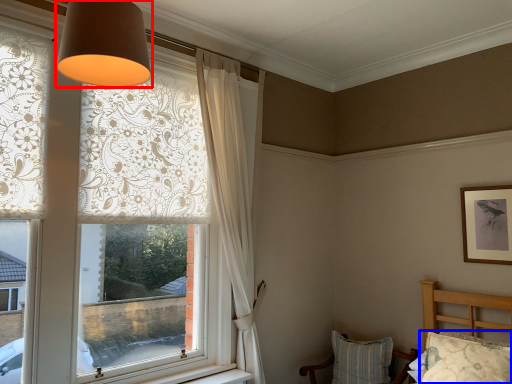
Question: Which point is further to the camera, lamp (highlighted by a red box) or pillow (highlighted by a blue box)?

Choices:
 (A) lamp
 (B) pillow

Answer: (B)